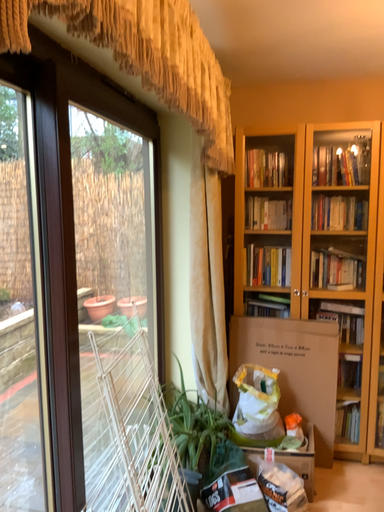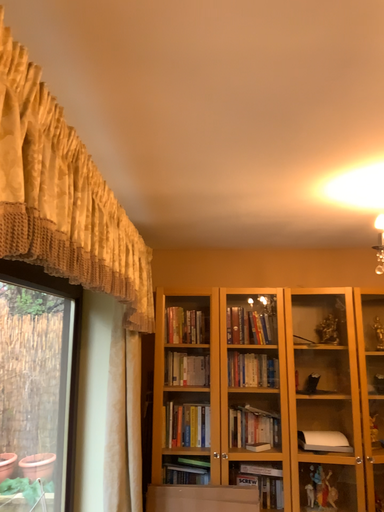
Question: Which way did the camera rotate in the video?

Choices:
 (A) rotated right
 (B) rotated left

Answer: (A)